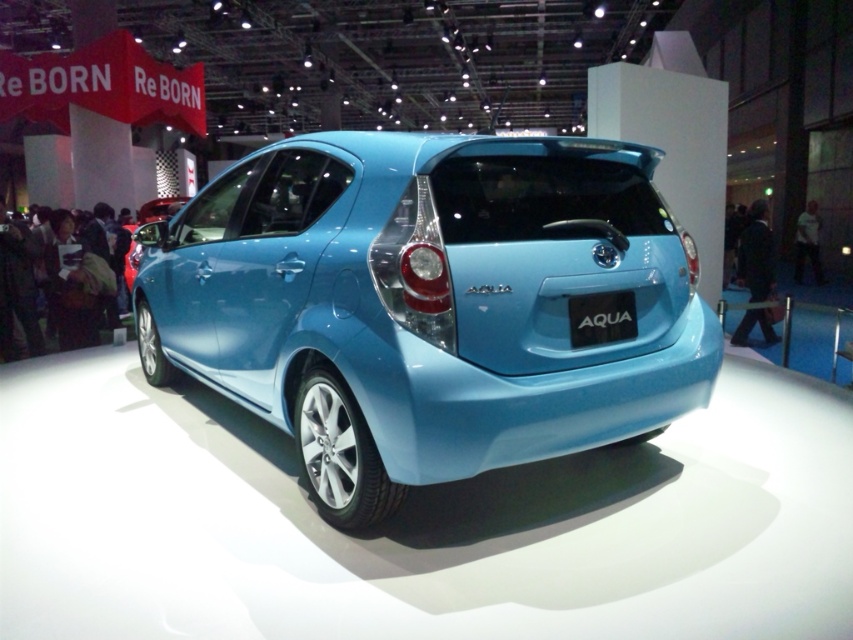
Question: Among these points, which one is nearest to the camera?

Choices:
 (A) [x=633, y=307]
 (B) [x=462, y=400]

Answer: (B)

Question: Is light blue metallic hatchback at center below blue glossy license plate at rear?

Choices:
 (A) no
 (B) yes

Answer: (A)

Question: Can you confirm if light blue metallic hatchback at center is positioned to the right of blue glossy license plate at rear?

Choices:
 (A) no
 (B) yes

Answer: (A)

Question: Which object appears farthest from the camera in this image?

Choices:
 (A) blue glossy license plate at rear
 (B) light blue metallic hatchback at center

Answer: (A)

Question: Does light blue metallic hatchback at center lie in front of blue glossy license plate at rear?

Choices:
 (A) yes
 (B) no

Answer: (A)

Question: Which point is farther to the camera?

Choices:
 (A) (339, 342)
 (B) (576, 330)

Answer: (B)